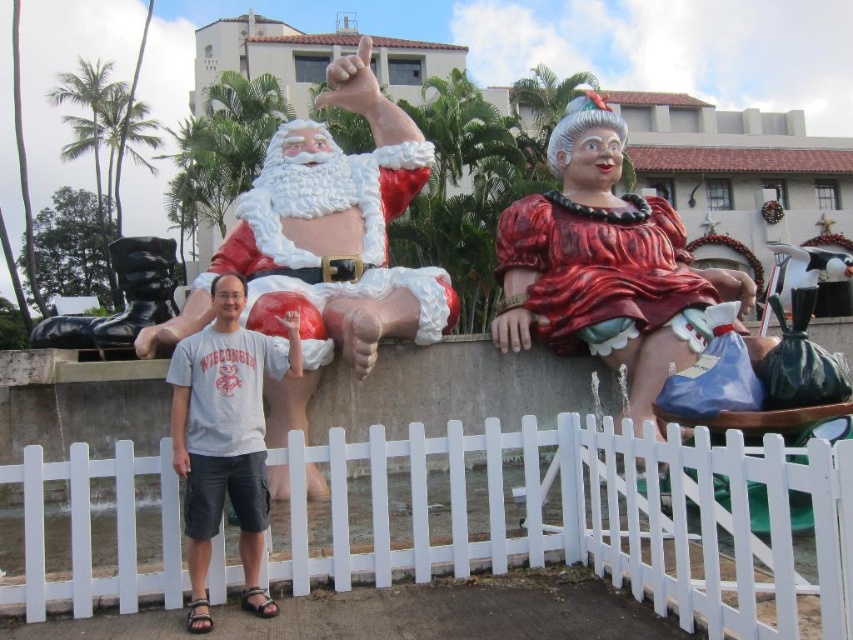
You are standing at the point marked as point (601, 518) in the festive outdoor scene. What object is located exactly at that point?

The white plastic picket fence at lower center is located exactly at point (601, 518).